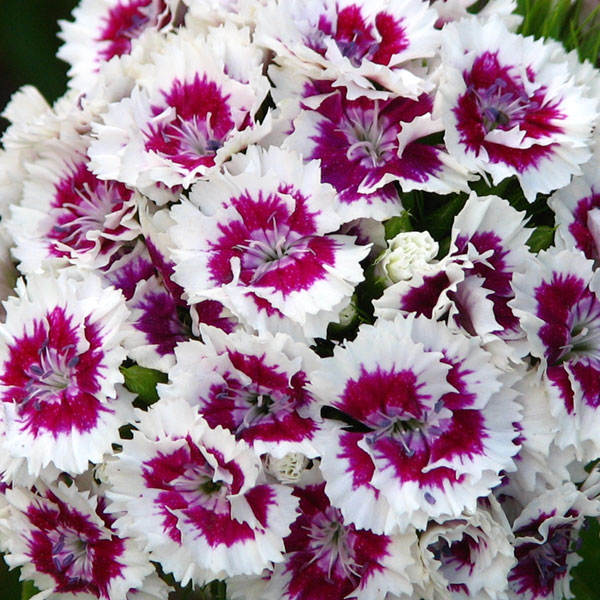
This screenshot has width=600, height=600. I want to click on purple pedastals, so click(463, 445).